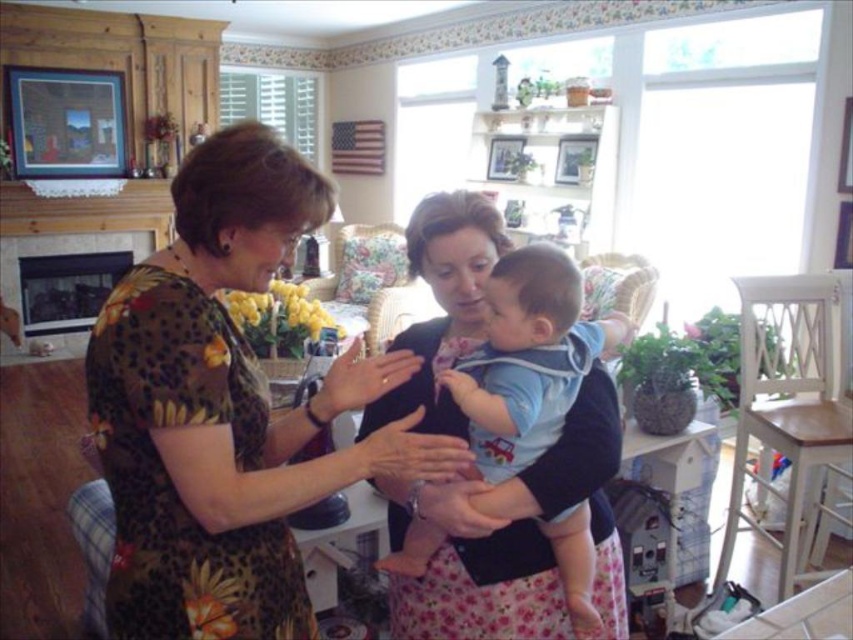
Which is more to the right, floral dress at center or light blue cotton shirt at center?

light blue cotton shirt at center is more to the right.

Consider the image. Does floral dress at center have a greater height compared to light blue cotton shirt at center?

Yes.

Is point (126, 509) behind point (567, 536)?

No.

Find the location of a particular element. Image resolution: width=853 pixels, height=640 pixels. floral dress at center is located at coordinates (225, 410).